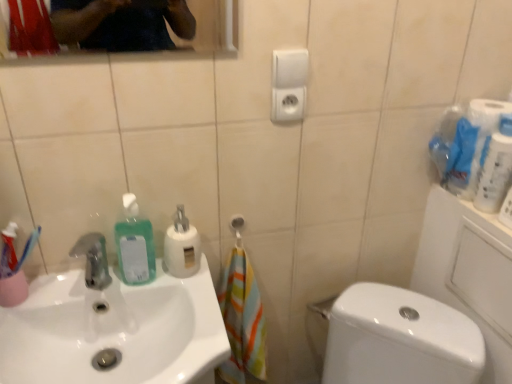
Find the location of a particular element. white glossy toilet paper at upper right is located at coordinates (465, 143).

The width and height of the screenshot is (512, 384). What do you see at coordinates (399, 339) in the screenshot?
I see `white glossy toilet at lower right` at bounding box center [399, 339].

How much space does green translucent liquid at sink left, positioned as the second cleaning product in right-to-left order, occupy vertically?

A: 8.36 inches.

What are the coordinates of `white glossy toilet paper at upper right` in the screenshot? It's located at (465, 143).

From a real-world perspective, is white matte soap dispenser at center, the 2th cleaning product viewed from the left, located beneath white glossy toilet paper at upper right?

Correct, in the physical world, white matte soap dispenser at center, the 2th cleaning product viewed from the left, is lower than white glossy toilet paper at upper right.

Do you think white matte soap dispenser at center, which is the 1th cleaning product in right-to-left order, is within white glossy toilet paper at upper right, or outside of it?

white matte soap dispenser at center, which is the 1th cleaning product in right-to-left order, is outside white glossy toilet paper at upper right.

Considering the relative positions of white matte soap dispenser at center, which is the 1th cleaning product in right-to-left order, and white glossy toilet paper at upper right in the image provided, is white matte soap dispenser at center, which is the 1th cleaning product in right-to-left order, to the right of white glossy toilet paper at upper right from the viewer's perspective?

No, white matte soap dispenser at center, which is the 1th cleaning product in right-to-left order, is not to the right of white glossy toilet paper at upper right.

Measure the distance between white matte soap dispenser at center, which is the 1th cleaning product in right-to-left order, and white glossy toilet paper at upper right.

white matte soap dispenser at center, which is the 1th cleaning product in right-to-left order, and white glossy toilet paper at upper right are 27.49 inches apart.

From the image's perspective, is white glossy toilet at lower right positioned above or below white glossy toilet paper at upper right?

Clearly, from the image's perspective, white glossy toilet at lower right is below white glossy toilet paper at upper right.

Could you tell me if white glossy toilet at lower right is facing white glossy toilet paper at upper right?

No.

What's the angular difference between white glossy toilet at lower right and white glossy toilet paper at upper right's facing directions?

The angle between the facing direction of white glossy toilet at lower right and the facing direction of white glossy toilet paper at upper right is 41.2 degrees.

Considering the positions of objects white glossy toilet at lower right and white glossy toilet paper at upper right in the image provided, who is behind, white glossy toilet at lower right or white glossy toilet paper at upper right?

white glossy toilet paper at upper right is further from the camera.

How many degrees apart are the facing directions of white matte soap dispenser at center, which is the 1th cleaning product in right-to-left order, and white glossy toilet at lower right?

The angular difference between white matte soap dispenser at center, which is the 1th cleaning product in right-to-left order, and white glossy toilet at lower right is 47.6 degrees.

Which point is more distant from viewer, [180,248] or [431,356]?

The point [431,356] is behind.

Does white matte soap dispenser at center, which is the 1th cleaning product in right-to-left order, contain white glossy toilet at lower right?

No.

How distant is white matte soap dispenser at center, which is the 1th cleaning product in right-to-left order, from white glossy toilet at lower right?

51.79 centimeters.

How many degrees apart are the facing directions of green translucent liquid at sink left, positioned as the second cleaning product in right-to-left order, and white glossy sink at lower left?

There is a 0.000618-degree angle between the facing directions of green translucent liquid at sink left, positioned as the second cleaning product in right-to-left order, and white glossy sink at lower left.

Does green translucent liquid at sink left, positioned as the second cleaning product in right-to-left order, turn towards white glossy sink at lower left?

No.

From a real-world perspective, is green translucent liquid at sink left, positioned as the second cleaning product in right-to-left order, beneath white glossy sink at lower left?

No, from a real-world perspective, green translucent liquid at sink left, positioned as the second cleaning product in right-to-left order, is not under white glossy sink at lower left.

Is green translucent liquid at sink left, positioned as the second cleaning product in right-to-left order, located outside white glossy sink at lower left?

Yes, green translucent liquid at sink left, positioned as the second cleaning product in right-to-left order, is not within white glossy sink at lower left.

Which is correct: white glossy toilet at lower right is inside white glossy sink at lower left, or outside of it?

white glossy toilet at lower right is outside white glossy sink at lower left.

Which object is further away from the camera, white glossy toilet at lower right or white glossy sink at lower left?

white glossy toilet at lower right is further from the camera.

Which is closer, (350, 367) or (180, 366)?

Point (350, 367).

Image resolution: width=512 pixels, height=384 pixels. I want to click on toilet paper that is behind the white matte soap dispenser at center, the 2th cleaning product viewed from the left, so click(x=465, y=143).

Is white glossy toilet paper at upper right positioned behind white matte soap dispenser at center, which is the 1th cleaning product in right-to-left order?

Yes, it is.

Does point (474, 115) appear closer or farther from the camera than point (172, 261)?

Point (474, 115) is farther from the camera than point (172, 261).

Does green translucent liquid at sink left, arranged as the first cleaning product when viewed from the left, turn towards white glossy toilet paper at upper right?

No, green translucent liquid at sink left, arranged as the first cleaning product when viewed from the left, is not turned towards white glossy toilet paper at upper right.

From the picture: Does green translucent liquid at sink left, arranged as the first cleaning product when viewed from the left, appear on the right side of white glossy toilet paper at upper right?

No.

From a real-world perspective, which is physically above, green translucent liquid at sink left, positioned as the second cleaning product in right-to-left order, or white glossy toilet paper at upper right?

From a 3D spatial view, white glossy toilet paper at upper right is above.

Identify the location of toilet paper above the white matte soap dispenser at center, which is the 1th cleaning product in right-to-left order (from a real-world perspective). (465, 143).

Locate an element on the screen. The height and width of the screenshot is (384, 512). toilet on the left of white glossy toilet paper at upper right is located at coordinates (399, 339).

Looking at this image, estimate the real-world distances between objects in this image. Which object is closer to white glossy toilet paper at upper right, white glossy toilet at lower right or white glossy sink at lower left?

The object closer to white glossy toilet paper at upper right is white glossy toilet at lower right.

Looking at the image, which one is located closer to green translucent liquid at sink left, arranged as the first cleaning product when viewed from the left, white matte soap dispenser at center, which is the 1th cleaning product in right-to-left order, or white glossy toilet paper at upper right?

white matte soap dispenser at center, which is the 1th cleaning product in right-to-left order, lies closer to green translucent liquid at sink left, arranged as the first cleaning product when viewed from the left, than the other object.

Looking at the image, which one is located closer to white glossy sink at lower left, white glossy toilet at lower right or white matte soap dispenser at center, which is the 1th cleaning product in right-to-left order?

white matte soap dispenser at center, which is the 1th cleaning product in right-to-left order, is closer to white glossy sink at lower left.

Considering their positions, is white glossy toilet at lower right positioned further to green translucent liquid at sink left, arranged as the first cleaning product when viewed from the left, than white glossy sink at lower left?

Based on the image, white glossy toilet at lower right appears to be further to green translucent liquid at sink left, arranged as the first cleaning product when viewed from the left.

Based on their spatial positions, is white matte soap dispenser at center, which is the 1th cleaning product in right-to-left order, or green translucent liquid at sink left, positioned as the second cleaning product in right-to-left order, closer to white glossy toilet at lower right?

Among the two, white matte soap dispenser at center, which is the 1th cleaning product in right-to-left order, is located nearer to white glossy toilet at lower right.

Looking at the image, which one is located further to white glossy toilet paper at upper right, white glossy sink at lower left or white glossy toilet at lower right?

Based on the image, white glossy sink at lower left appears to be further to white glossy toilet paper at upper right.

Consider the image. Based on their spatial positions, is white glossy sink at lower left or white glossy toilet paper at upper right further from white glossy toilet at lower right?

Based on the image, white glossy sink at lower left appears to be further to white glossy toilet at lower right.

Looking at the image, which one is located further to white glossy toilet at lower right, white glossy toilet paper at upper right or white matte soap dispenser at center, which is the 1th cleaning product in right-to-left order?

Among the two, white matte soap dispenser at center, which is the 1th cleaning product in right-to-left order, is located further to white glossy toilet at lower right.

What are the coordinates of `cleaning product between green translucent liquid at sink left, arranged as the first cleaning product when viewed from the left, and white glossy sink at lower left in the up-down direction` in the screenshot? It's located at (182, 246).

This screenshot has height=384, width=512. What are the coordinates of `toilet between white glossy sink at lower left and white glossy toilet paper at upper right in the horizontal direction` in the screenshot? It's located at (399, 339).

The image size is (512, 384). Find the location of `cleaning product situated between green translucent liquid at sink left, positioned as the second cleaning product in right-to-left order, and white glossy toilet at lower right from left to right`. cleaning product situated between green translucent liquid at sink left, positioned as the second cleaning product in right-to-left order, and white glossy toilet at lower right from left to right is located at coordinates (182, 246).

In order to click on toilet situated between green translucent liquid at sink left, arranged as the first cleaning product when viewed from the left, and white glossy toilet paper at upper right from left to right in this screenshot , I will do `click(399, 339)`.